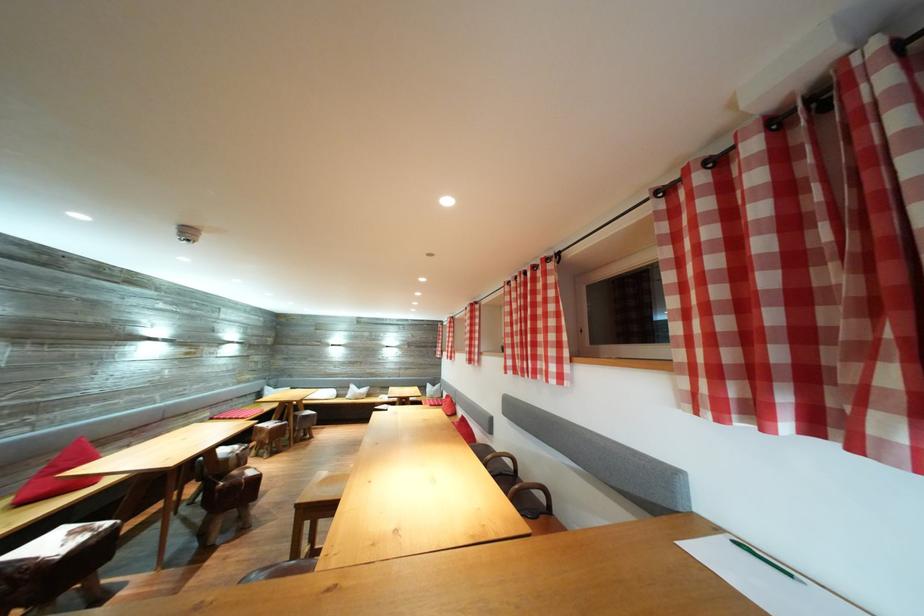
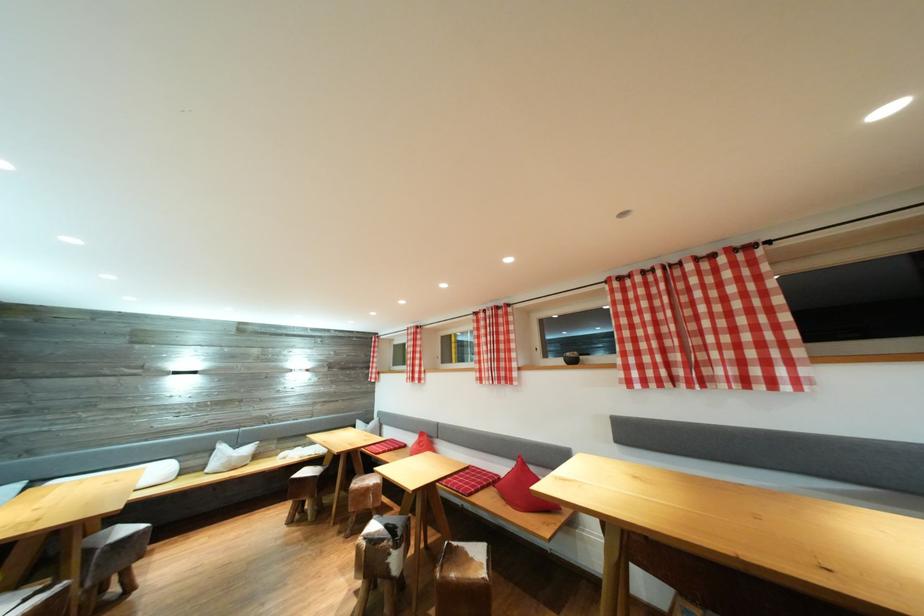
In the second image, find the point that corresponds to (x=456, y=338) in the first image.

(421, 351)